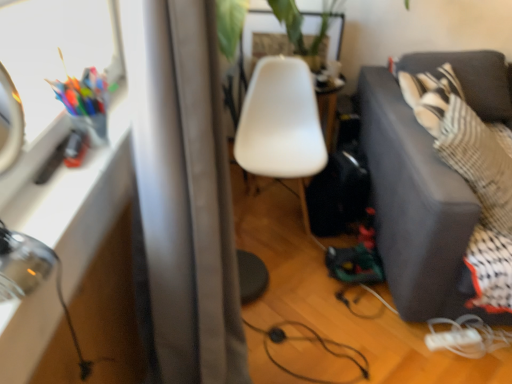
Question: From a real-world perspective, is white plastic chair at center above or below white matte extension cord at lower right?

Choices:
 (A) below
 (B) above

Answer: (B)

Question: Considering their positions, is white plastic chair at center located in front of or behind white matte extension cord at lower right?

Choices:
 (A) behind
 (B) front

Answer: (A)

Question: Estimate the real-world distances between objects in this image. Which object is farther from the white matte extension cord at lower right?

Choices:
 (A) white plastic chair at center
 (B) dark gray fabric couch at right
 (C) clear glass table at left

Answer: (C)

Question: Which object is positioned closest to the white plastic chair at center?

Choices:
 (A) white matte extension cord at lower right
 (B) clear glass table at left
 (C) dark gray fabric couch at right

Answer: (C)